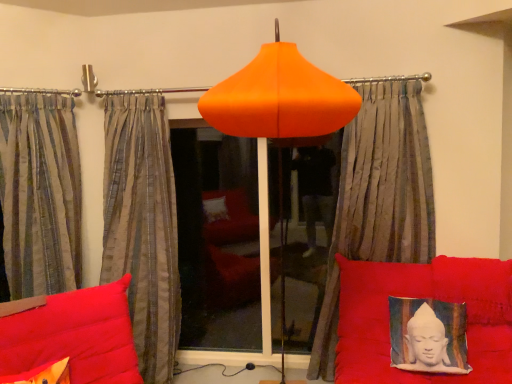
Question: Is orange matte lampshade at center wider or thinner than transparent glass window at center?

Choices:
 (A) wide
 (B) thin

Answer: (A)

Question: Relative to transparent glass window at center, is orange matte lampshade at center in front or behind?

Choices:
 (A) front
 (B) behind

Answer: (A)

Question: Which object is the closest to the textured fabric cushion with buddha print at lower right?

Choices:
 (A) striped fabric curtain at left, which appears as the first curtain when viewed from the left
 (B) transparent glass window at center
 (C) orange matte lampshade at center
 (D) silky gray curtain at center, acting as the first curtain starting from the right
 (E) velvet cushion with buddha print at lower right

Answer: (E)

Question: Estimate the real-world distances between objects in this image. Which object is closer to the transparent glass window at center?

Choices:
 (A) textured fabric cushion with buddha print at lower right
 (B) matte orange pillow at lower left
 (C) silky gray curtain at center, acting as the first curtain starting from the right
 (D) striped fabric curtain at left, which appears as the 3th curtain when viewed from the right
 (E) velvet cushion with buddha print at lower right

Answer: (D)